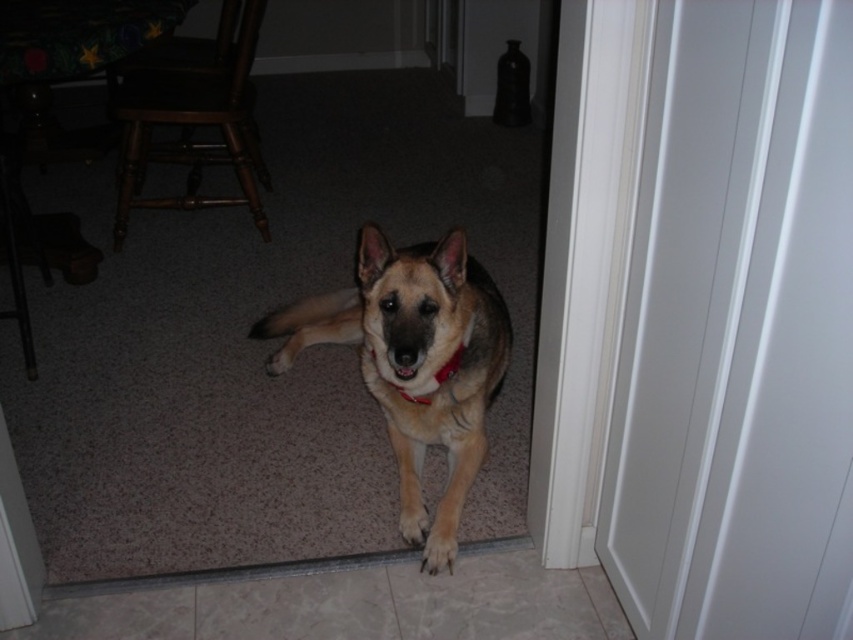
You are standing in the room and want to pick up the brown fur paw at lower center. Can you reach it without moving the golden fur dog at center?

The golden fur dog at center is in front of the brown fur paw at lower center, so you cannot reach the brown fur paw at lower center without moving the golden fur dog at center first.